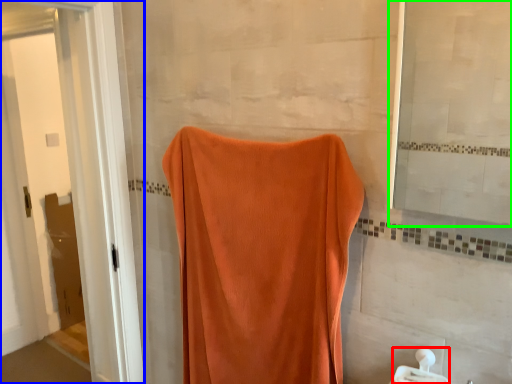
Question: Which object is the closest to the towel bar (highlighted by a red box)? Choose among these: screen door (highlighted by a blue box) or mirror (highlighted by a green box).

Choices:
 (A) screen door
 (B) mirror

Answer: (B)